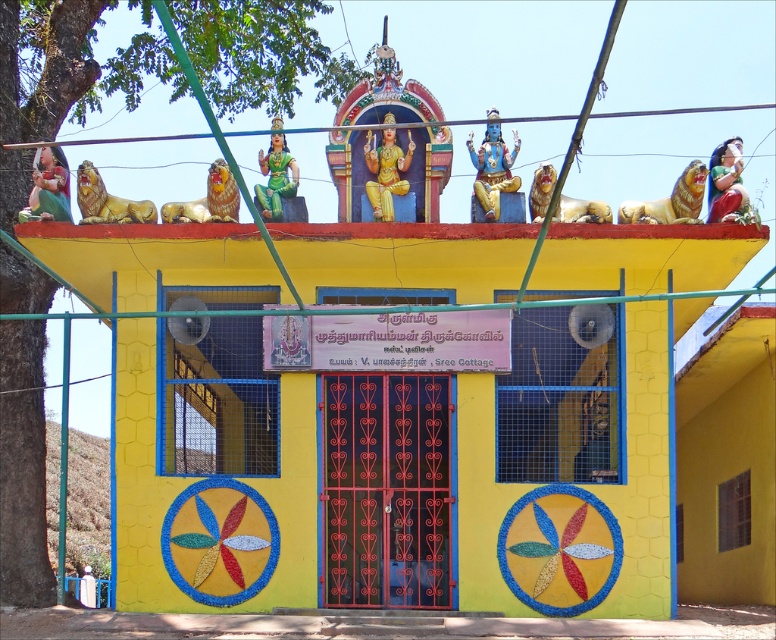
Question: Which point is farther from the camera taking this photo?

Choices:
 (A) (x=534, y=170)
 (B) (x=485, y=204)

Answer: (A)

Question: Where is gold metallic lion at upper right located in relation to green glossy statue at center in the image?

Choices:
 (A) below
 (B) above

Answer: (A)

Question: Can you confirm if matte green statue at upper center is thinner than green glossy statue at center?

Choices:
 (A) yes
 (B) no

Answer: (A)

Question: Estimate the real-world distances between objects in this image. Which object is farther from the matte green statue at left?

Choices:
 (A) gold metallic lion at center
 (B) gold metallic statue at center

Answer: (A)

Question: Which object is farther from the camera taking this photo?

Choices:
 (A) gold metallic lion at upper left
 (B) gold metallic lion at upper right
 (C) blue metallic statue at upper center

Answer: (A)

Question: Can you confirm if matte green statue at upper center is thinner than gold metallic lion at upper left?

Choices:
 (A) yes
 (B) no

Answer: (A)